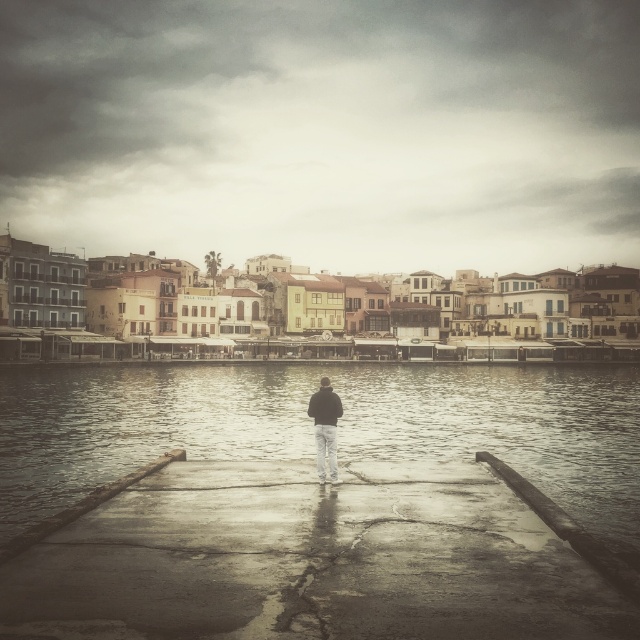
Between point (346, 584) and point (310, 406), which one is positioned behind?

The point (310, 406) is behind.

Is point (195, 525) more distant than point (324, 417)?

No, (195, 525) is closer to viewer.

This screenshot has height=640, width=640. I want to click on concrete wet dock at center, so click(308, 561).